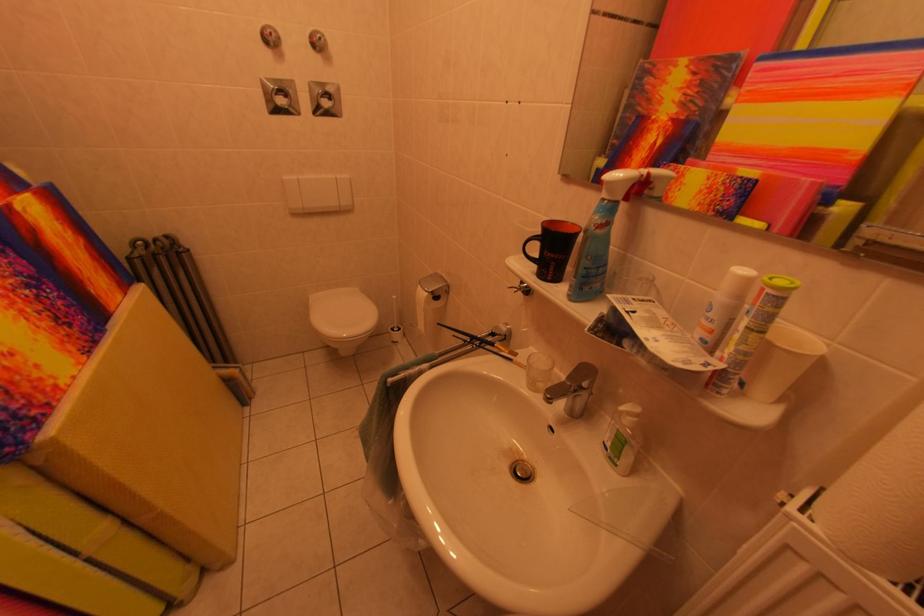
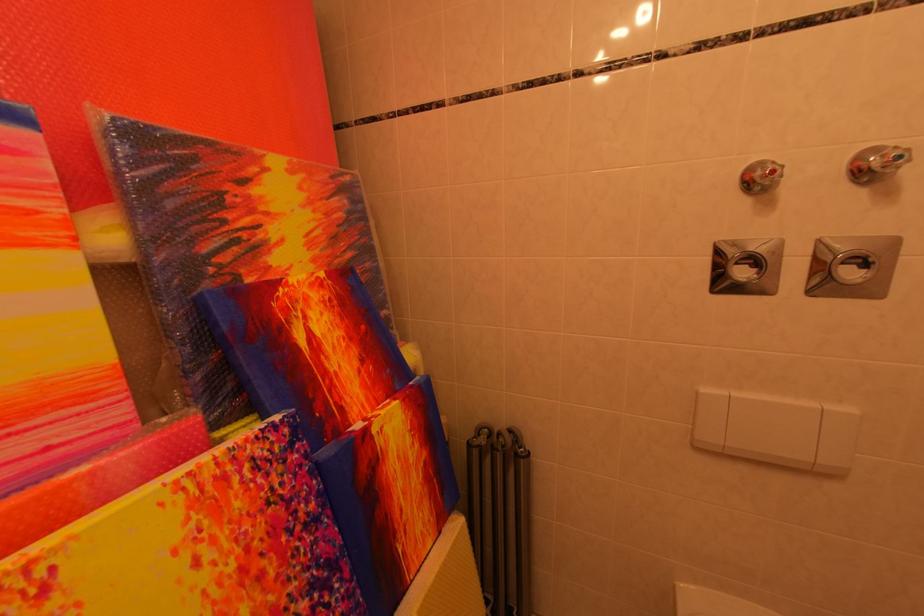
The point at (334, 103) is marked in the first image. Where is the corresponding point in the second image?

(864, 270)